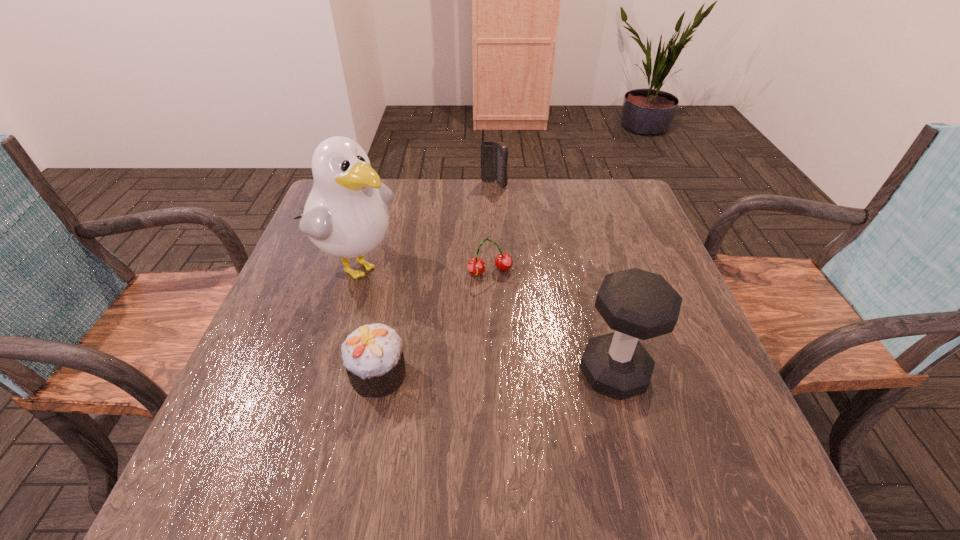
I want to click on free spot between the cupcake and the tallest object, so click(x=367, y=319).

Locate an element on the screen. free space that is in between the second tallest object and the cupcake is located at coordinates (496, 374).

Identify the location of vacant point located between the cellular telephone and the rightmost object. (554, 279).

Identify the location of vacant area between the farthest object and the tallest object. (424, 224).

Identify the location of vacant area between the dumbbell and the third tallest object. The width and height of the screenshot is (960, 540). (554, 279).

This screenshot has width=960, height=540. I want to click on empty space between the tallest object and the fourth shortest object, so click(485, 318).

Find the location of a particular element. The width and height of the screenshot is (960, 540). free point between the cupcake and the rightmost object is located at coordinates (496, 374).

Find the location of a particular element. This screenshot has height=540, width=960. unoccupied position between the cellular telephone and the gull is located at coordinates (424, 224).

The image size is (960, 540). In order to click on vacant space in between the gull and the cherry in this screenshot , I will do `click(422, 268)`.

I want to click on vacant point located between the gull and the dumbbell, so click(x=485, y=318).